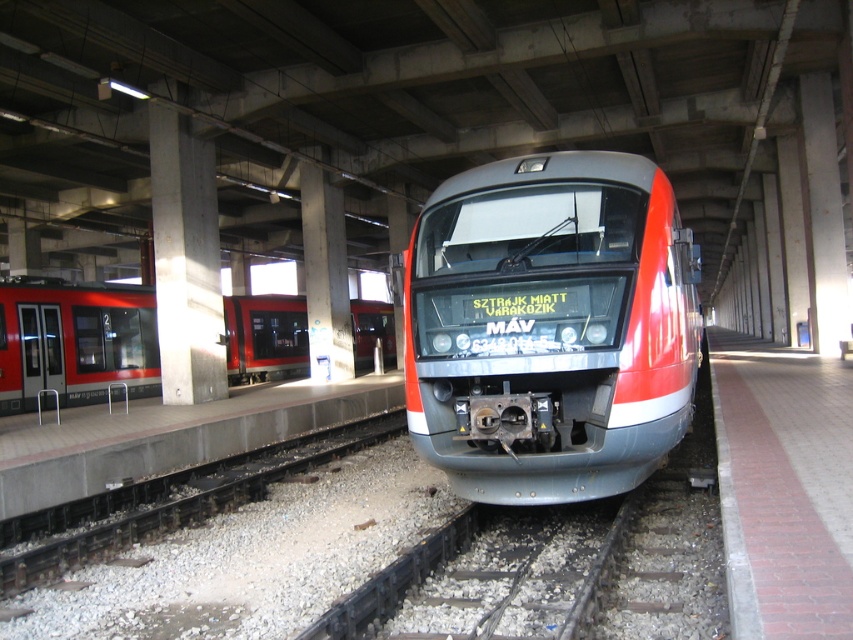
Question: Does metallic gray train at center have a larger size compared to matte red train at left?

Choices:
 (A) yes
 (B) no

Answer: (B)

Question: Which object appears farthest from the camera in this image?

Choices:
 (A) metallic gray train at center
 (B) matte red train at left

Answer: (B)

Question: Which point appears closest to the camera in this image?

Choices:
 (A) (563, 248)
 (B) (294, 346)

Answer: (A)

Question: Is metallic gray train at center to the left of matte red train at left from the viewer's perspective?

Choices:
 (A) no
 (B) yes

Answer: (A)

Question: Does metallic gray train at center appear on the left side of matte red train at left?

Choices:
 (A) no
 (B) yes

Answer: (A)

Question: Which point is closer to the camera?

Choices:
 (A) (524, 481)
 (B) (392, 320)

Answer: (A)